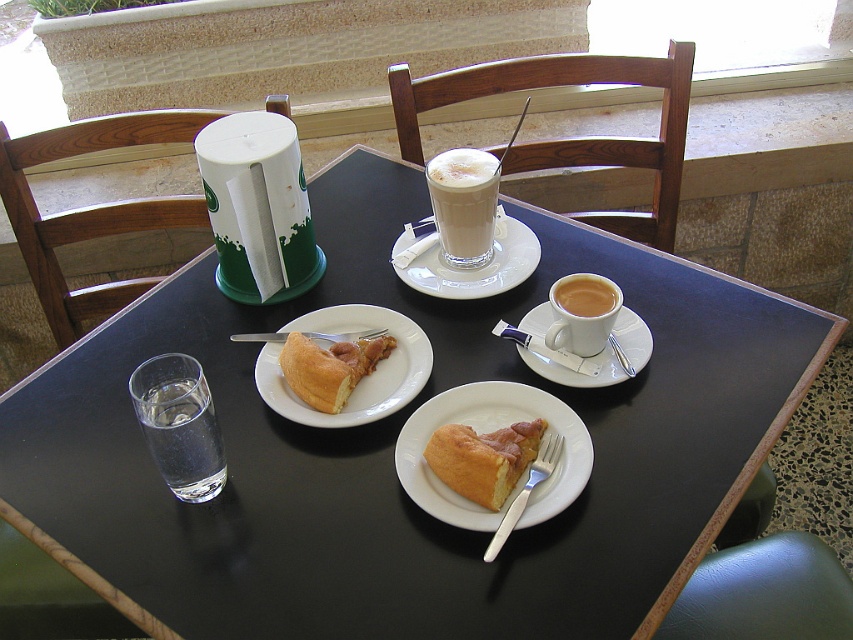
Who is lower down, clear glass water at lower left or white ceramic saucer at center?

clear glass water at lower left is lower down.

Is clear glass water at lower left wider than white ceramic saucer at center?

In fact, clear glass water at lower left might be narrower than white ceramic saucer at center.

Locate an element on the screen. clear glass water at lower left is located at coordinates (181, 435).

From the picture: Does yellow cake at center lie behind matte white cup at center right?

No.

Where is `yellow cake at center`? Image resolution: width=853 pixels, height=640 pixels. yellow cake at center is located at coordinates (483, 458).

Is matte white plate at center in front of white matte plate at center?

Yes, matte white plate at center is in front of white matte plate at center.

Identify the location of matte white plate at center. The height and width of the screenshot is (640, 853). (485, 433).

Which is in front, point (579, 442) or point (398, 408)?

Point (579, 442) is more forward.

Where is `matte white plate at center`? matte white plate at center is located at coordinates coord(485,433).